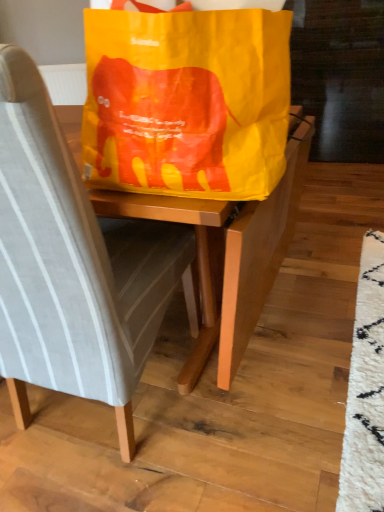
Locate an element on the screen. vacant space to the right of light gray fabric chair at center is located at coordinates (x=260, y=395).